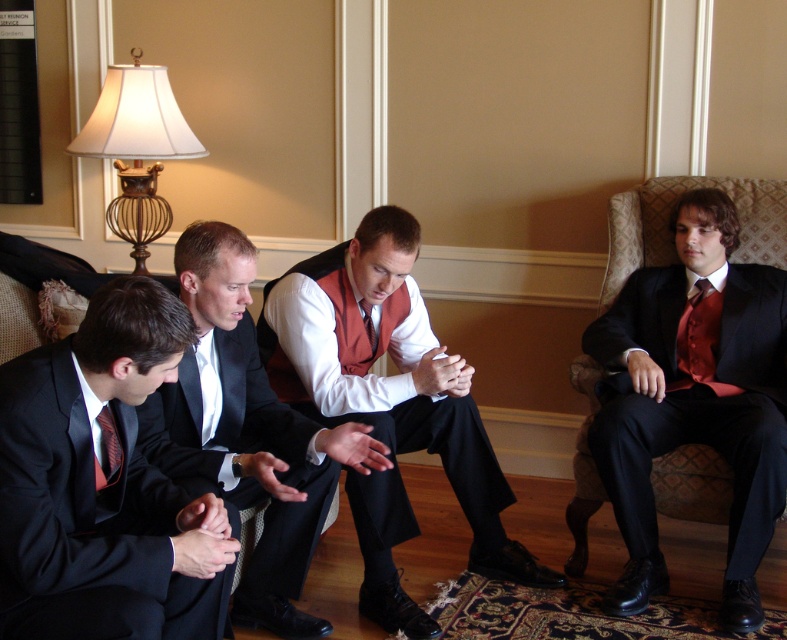
Question: Which of the following is the farthest from the observer?

Choices:
 (A) (320, 518)
 (B) (342, 417)

Answer: (B)

Question: Does matte black suit at right lie in front of matte black suit at center?

Choices:
 (A) no
 (B) yes

Answer: (A)

Question: Which is farther from the matte cream lampshade at upper left?

Choices:
 (A) matte black suit at left
 (B) matte black suit at center

Answer: (A)

Question: Can you confirm if matte black tie at lower left is positioned above matte red tie at center?

Choices:
 (A) no
 (B) yes

Answer: (A)

Question: Does matte black suit at center lie in front of matte cream lampshade at upper left?

Choices:
 (A) no
 (B) yes

Answer: (B)

Question: Which object is closer to the camera taking this photo?

Choices:
 (A) matte black suit at left
 (B) matte black suit at center

Answer: (A)